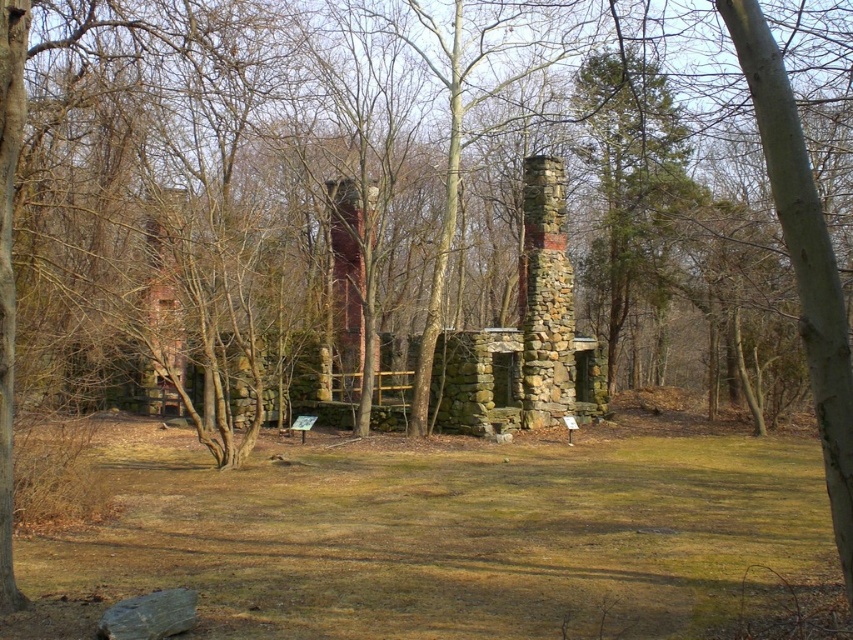
Which is more to the left, green grass at center or red brick chimney at center?

From the viewer's perspective, red brick chimney at center appears more on the left side.

Measure the distance between point (19, 576) and camera.

A distance of 36.25 feet exists between point (19, 576) and camera.

At what (x,y) coordinates should I click in order to perform the action: click on green grass at center. Please return your answer as a coordinate pair (x, y). The image size is (853, 640). Looking at the image, I should click on (440, 536).

Who is lower down, green grass at center or stone chimney at center?

green grass at center is below.

Is green grass at center above stone chimney at center?

Actually, green grass at center is below stone chimney at center.

The image size is (853, 640). Find the location of `green grass at center`. green grass at center is located at coordinates (440, 536).

Measure the distance from stone chimney at center to red brick chimney at center.

stone chimney at center is 4.93 meters from red brick chimney at center.

Does stone chimney at center appear on the right side of red brick chimney at center?

Yes, stone chimney at center is to the right of red brick chimney at center.

Does point (527, 257) come in front of point (374, 198)?

No, (527, 257) is behind (374, 198).

This screenshot has width=853, height=640. I want to click on stone chimney at center, so tap(544, 296).